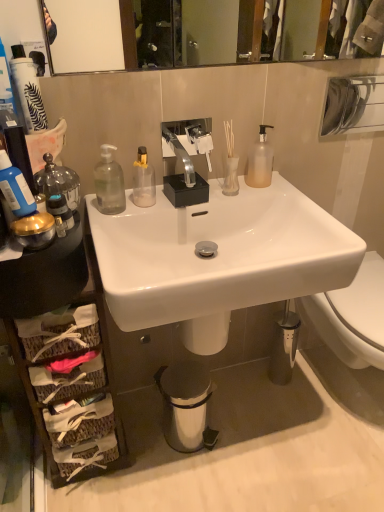
Locate an element on the screen. This screenshot has width=384, height=512. vacant space to the right of white frosted glass vase at upper center is located at coordinates (263, 185).